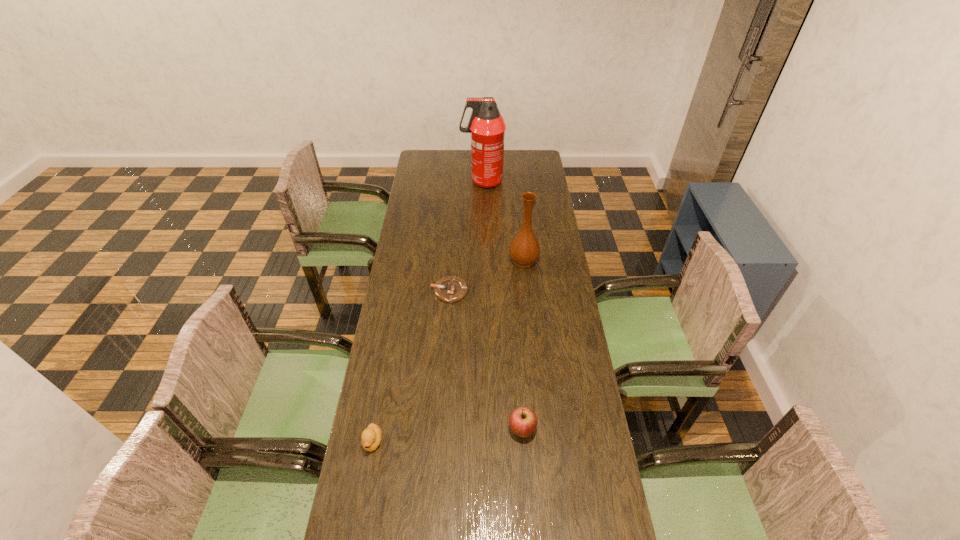
Identify the location of free location located 0.190m on the trigger side of the fire extinguisher. The width and height of the screenshot is (960, 540). (425, 181).

Where is `free space located on the trigger side of the fire extinguisher`? The width and height of the screenshot is (960, 540). free space located on the trigger side of the fire extinguisher is located at coordinates (441, 181).

Locate an element on the screen. This screenshot has width=960, height=540. free spot located on the right of the vase is located at coordinates (555, 261).

Where is `free space located on the back of the apple`? free space located on the back of the apple is located at coordinates (518, 384).

Where is `vacant space located 0.060m on the face of the duckling`? vacant space located 0.060m on the face of the duckling is located at coordinates (367, 477).

Where is `vacant space situated on the back of the ashtray`? Image resolution: width=960 pixels, height=540 pixels. vacant space situated on the back of the ashtray is located at coordinates (452, 247).

Where is `object that is at the far edge`? This screenshot has height=540, width=960. object that is at the far edge is located at coordinates (487, 127).

Where is `object positioned at the left edge`? object positioned at the left edge is located at coordinates (371, 437).

At what (x,y) coordinates should I click in order to perform the action: click on object that is at the right edge. Please return your answer as a coordinate pair (x, y). The width and height of the screenshot is (960, 540). Looking at the image, I should click on (524, 249).

You are a GUI agent. You are given a task and a screenshot of the screen. Output one action in this format:
    pyautogui.click(x=<x>, y=<y>)
    Task: Click on the blank space at the far edge
    This screenshot has width=960, height=540.
    Given the screenshot: What is the action you would take?
    pyautogui.click(x=466, y=153)